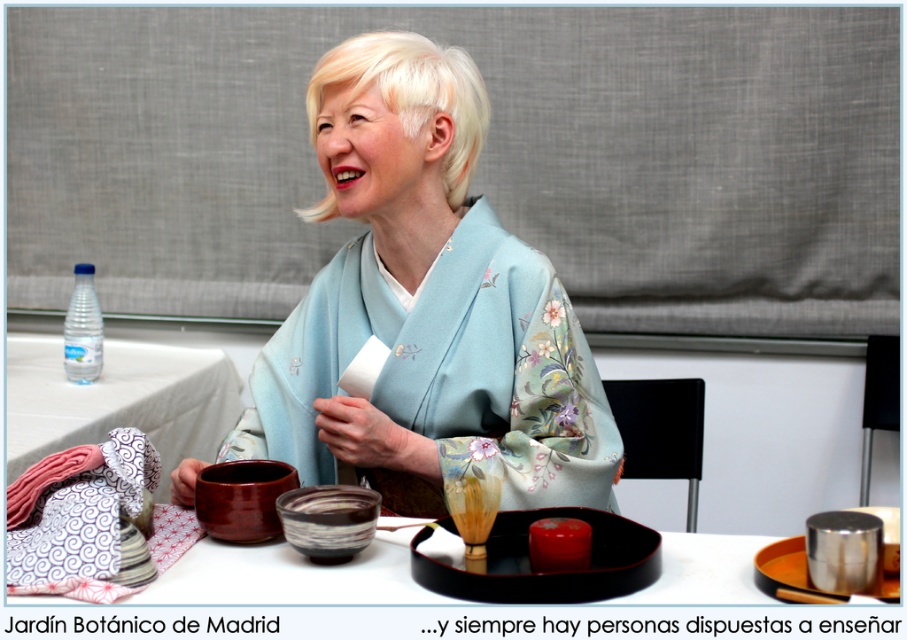
Can you confirm if light blue silk kimono at center is bigger than clear plastic bottle at upper left?

Yes.

Can you confirm if light blue silk kimono at center is smaller than clear plastic bottle at upper left?

Actually, light blue silk kimono at center might be larger than clear plastic bottle at upper left.

This screenshot has width=907, height=640. What do you see at coordinates (426, 308) in the screenshot? I see `light blue silk kimono at center` at bounding box center [426, 308].

Locate an element on the screen. This screenshot has height=640, width=907. light blue silk kimono at center is located at coordinates (426, 308).

Measure the distance between point (400, 227) and camera.

Point (400, 227) and camera are 5.25 feet apart from each other.

Does point (495, 403) come closer to viewer compared to point (236, 408)?

That is True.

Where is `light blue silk kimono at center`? light blue silk kimono at center is located at coordinates (426, 308).

Is white fabric table at left bigger than clear plastic bottle at upper left?

Correct, white fabric table at left is larger in size than clear plastic bottle at upper left.

Is white fabric table at left wider than clear plastic bottle at upper left?

Correct, the width of white fabric table at left exceeds that of clear plastic bottle at upper left.

Locate an element on the screen. white fabric table at left is located at coordinates (118, 401).